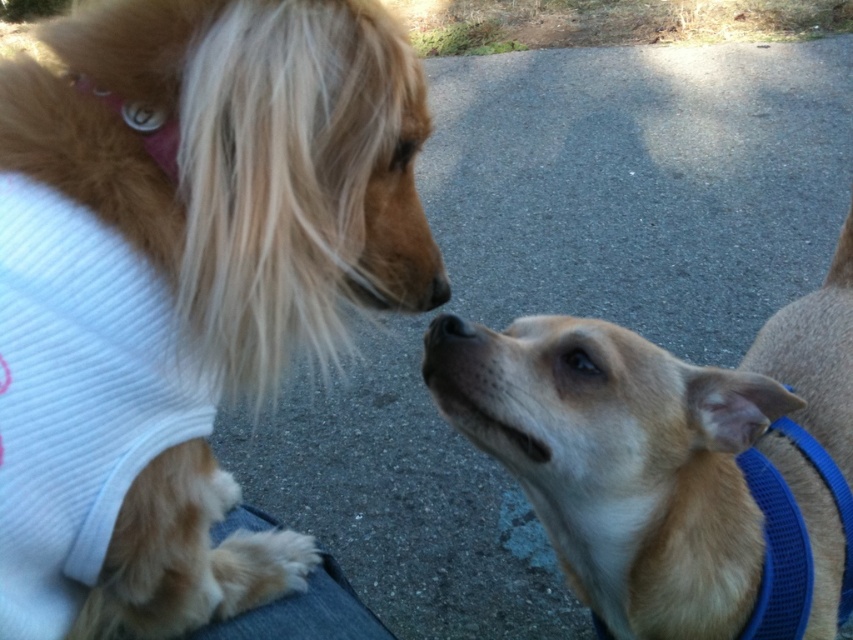
Question: Does soft golden fur at upper left come behind light brown fur at center?

Choices:
 (A) yes
 (B) no

Answer: (B)

Question: Which of the following is the farthest from the observer?

Choices:
 (A) soft golden fur at upper left
 (B) light brown fur at center

Answer: (B)

Question: Is soft golden fur at upper left above light brown fur at center?

Choices:
 (A) yes
 (B) no

Answer: (A)

Question: Can you confirm if soft golden fur at upper left is wider than light brown fur at center?

Choices:
 (A) yes
 (B) no

Answer: (B)